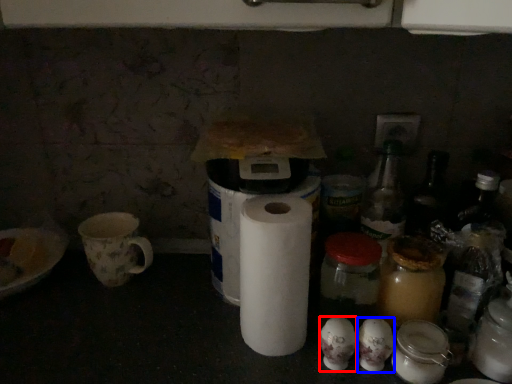
Question: Which of the following is the farthest to the observer, toilet paper (highlighted by a red box) or toilet paper (highlighted by a blue box)?

Choices:
 (A) toilet paper
 (B) toilet paper

Answer: (A)